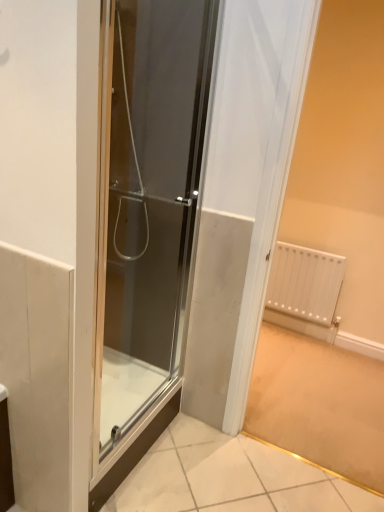
What are the coordinates of `transparent glass shower door at center` in the screenshot? It's located at (152, 200).

Measure the distance between point [183,84] and camera.

5.70 feet.

Describe the element at coordinates (152, 200) in the screenshot. I see `transparent glass shower door at center` at that location.

Where is `transparent glass shower door at center`? Image resolution: width=384 pixels, height=512 pixels. transparent glass shower door at center is located at coordinates (152, 200).